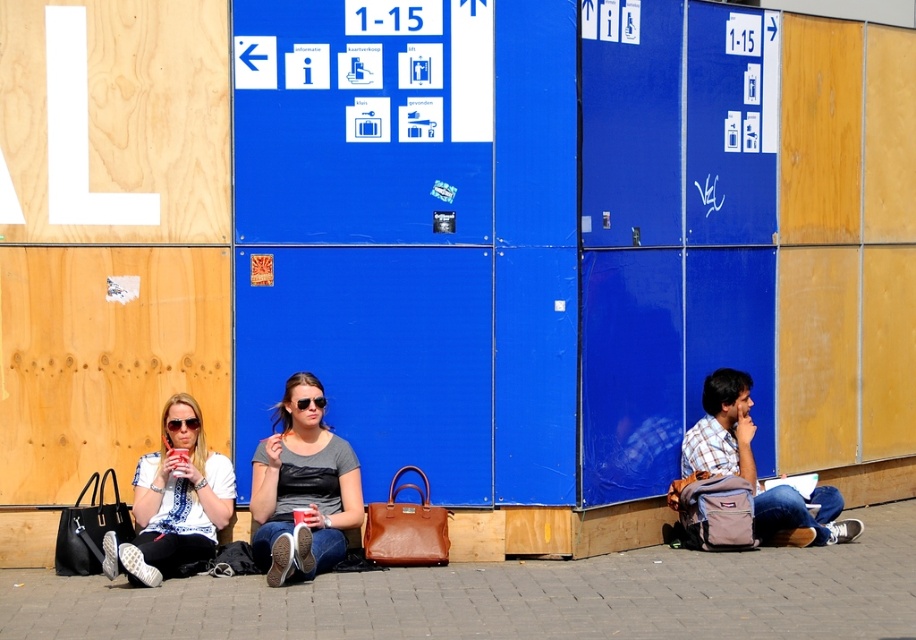
Question: Estimate the real-world distances between objects in this image. Which object is closer to the plaid cotton shirt at lower right?

Choices:
 (A) matte white sunglasses at left
 (B) matte gray shirt at center

Answer: (B)

Question: Is smooth concrete pavement at center bigger than matte black sunglasses at center?

Choices:
 (A) no
 (B) yes

Answer: (A)

Question: Which point is farther to the camera?

Choices:
 (A) plaid cotton shirt at lower right
 (B) matte gray shirt at center

Answer: (A)

Question: Based on their relative distances, which object is nearer to the plaid cotton shirt at lower right?

Choices:
 (A) matte white sunglasses at left
 (B) smooth concrete pavement at center
 (C) matte black sunglasses at center
 (D) matte gray shirt at center

Answer: (B)

Question: Is the position of smooth concrete pavement at center more distant than that of matte white sunglasses at left?

Choices:
 (A) no
 (B) yes

Answer: (A)

Question: Does smooth concrete pavement at center appear on the left side of matte gray shirt at center?

Choices:
 (A) no
 (B) yes

Answer: (A)